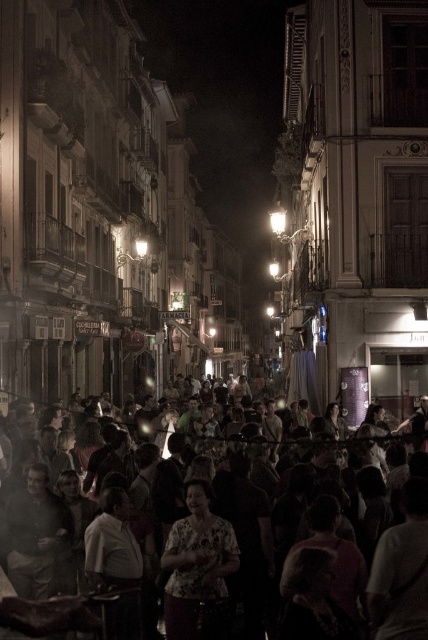
Does multicolored fabric crowd at center have a lesser height compared to floral print blouse at center?

No, multicolored fabric crowd at center is not shorter than floral print blouse at center.

Does multicolored fabric crowd at center lie in front of floral print blouse at center?

No, multicolored fabric crowd at center is behind floral print blouse at center.

Where is `multicolored fabric crowd at center`? multicolored fabric crowd at center is located at coordinates (327, 465).

At what (x,y) coordinates should I click in order to perform the action: click on multicolored fabric crowd at center. Please return your answer as a coordinate pair (x, y). The height and width of the screenshot is (640, 428). Looking at the image, I should click on (327, 465).